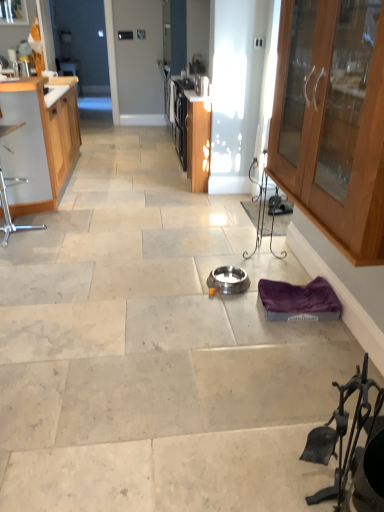
Where is `free space in front of metallic silver chair at left, positioned as the 2th chair in right-to-left order`? This screenshot has height=512, width=384. free space in front of metallic silver chair at left, positioned as the 2th chair in right-to-left order is located at coordinates (19, 256).